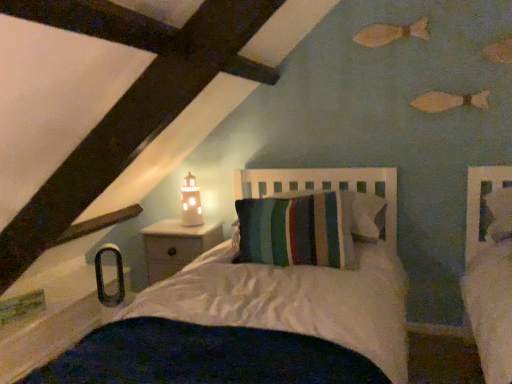
Question: Is striped fabric pillow at center facing away from white wood nightstand at lower left?

Choices:
 (A) no
 (B) yes

Answer: (A)

Question: Does striped fabric pillow at center have a larger size compared to white wood nightstand at lower left?

Choices:
 (A) yes
 (B) no

Answer: (A)

Question: Can you confirm if striped fabric pillow at center is positioned to the left of white wood nightstand at lower left?

Choices:
 (A) no
 (B) yes

Answer: (A)

Question: Is striped fabric pillow at center smaller than white wood nightstand at lower left?

Choices:
 (A) yes
 (B) no

Answer: (B)

Question: From the image's perspective, is striped fabric pillow at center located beneath white wood nightstand at lower left?

Choices:
 (A) yes
 (B) no

Answer: (B)

Question: Can you confirm if striped fabric pillow at center is positioned to the right of white wood nightstand at lower left?

Choices:
 (A) no
 (B) yes

Answer: (B)

Question: Does striped fabric pillow at center have a smaller size compared to matte white lighthouse at upper center?

Choices:
 (A) yes
 (B) no

Answer: (B)

Question: Is striped fabric pillow at center at the right side of matte white lighthouse at upper center?

Choices:
 (A) yes
 (B) no

Answer: (A)

Question: Can matte white lighthouse at upper center be found inside striped fabric pillow at center?

Choices:
 (A) no
 (B) yes

Answer: (A)

Question: From a real-world perspective, is striped fabric pillow at center located beneath matte white lighthouse at upper center?

Choices:
 (A) yes
 (B) no

Answer: (A)

Question: Is striped fabric pillow at center positioned beyond the bounds of matte white lighthouse at upper center?

Choices:
 (A) yes
 (B) no

Answer: (A)

Question: From a real-world perspective, is striped fabric pillow at center positioned over matte white lighthouse at upper center based on gravity?

Choices:
 (A) yes
 (B) no

Answer: (B)

Question: Could you tell me if matte white lighthouse at upper center is facing striped fabric pillow at center?

Choices:
 (A) yes
 (B) no

Answer: (B)